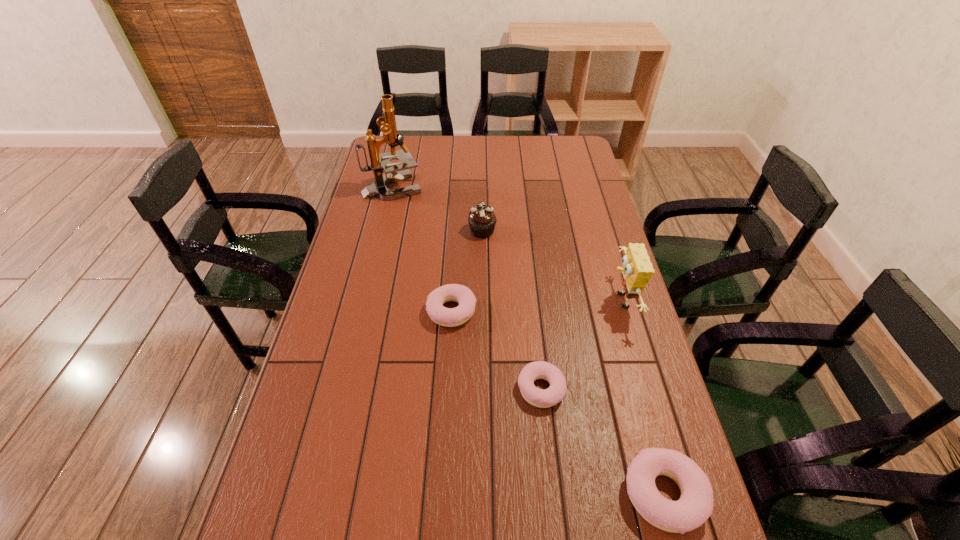
Find the location of `vacant place for an extra doughnut on the left`. vacant place for an extra doughnut on the left is located at coordinates (385, 252).